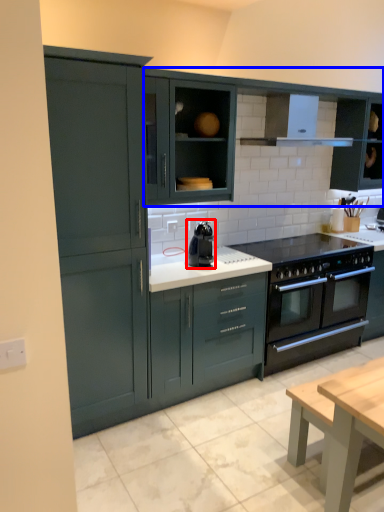
Question: Which object is closer to the camera taking this photo, kitchen appliance (highlighted by a red box) or cabinetry (highlighted by a blue box)?

Choices:
 (A) kitchen appliance
 (B) cabinetry

Answer: (A)